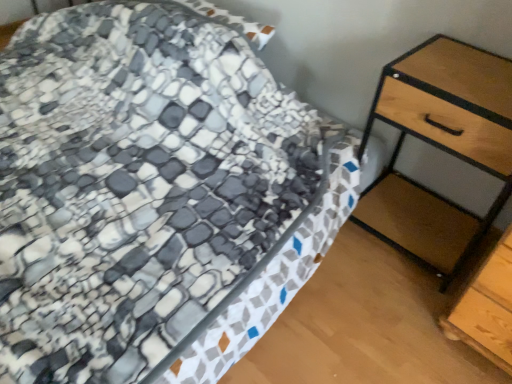
What do you see at coordinates (441, 145) in the screenshot? The image size is (512, 384). I see `wooden chest of drawers at right` at bounding box center [441, 145].

The height and width of the screenshot is (384, 512). Find the location of `wooden chest of drawers at right`. wooden chest of drawers at right is located at coordinates (441, 145).

The width and height of the screenshot is (512, 384). I want to click on wooden chest of drawers at right, so click(441, 145).